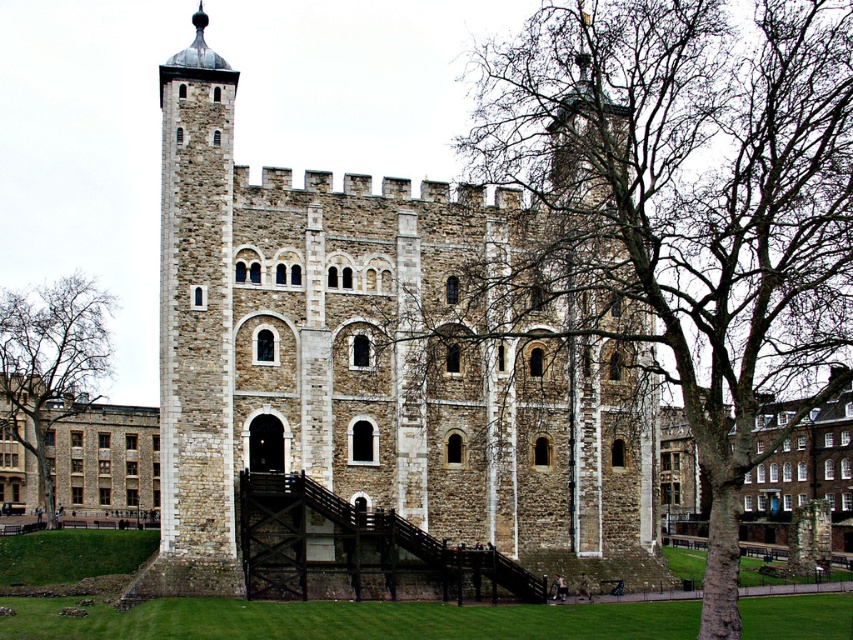
Question: Among these points, which one is farthest from the camera?

Choices:
 (A) (799, 22)
 (B) (369, 328)
 (C) (219, 266)
 (D) (0, 385)

Answer: (D)

Question: Does stone tower at left appear over bare branches at left?

Choices:
 (A) yes
 (B) no

Answer: (A)

Question: Which point appears farthest from the camera in this image?

Choices:
 (A) (793, 344)
 (B) (32, 401)
 (C) (200, 275)

Answer: (B)

Question: Does bare wood tree at center appear on the left side of stone tower at left?

Choices:
 (A) yes
 (B) no

Answer: (B)

Question: Is stone tower at left to the right of bare branches at left from the viewer's perspective?

Choices:
 (A) no
 (B) yes

Answer: (B)

Question: Which object is farther from the camera taking this photo?

Choices:
 (A) bare wood tree at center
 (B) stone tower at center

Answer: (B)